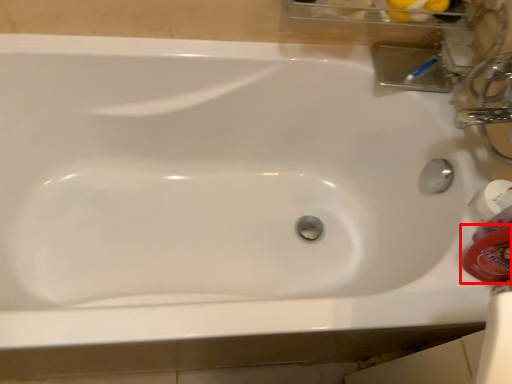
Question: From the image's perspective, where is mouthwash (annotated by the red box) located relative to mouthwash?

Choices:
 (A) above
 (B) below

Answer: (B)